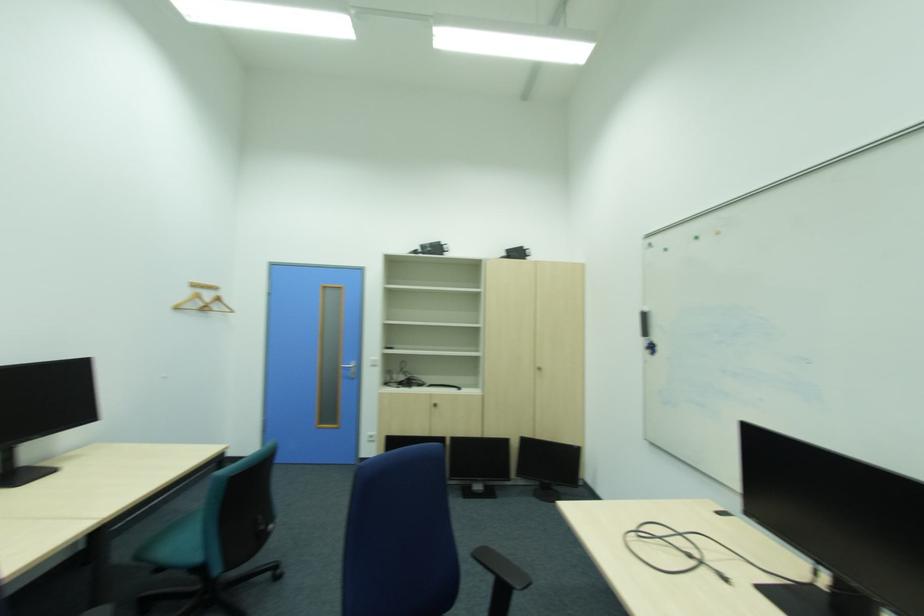
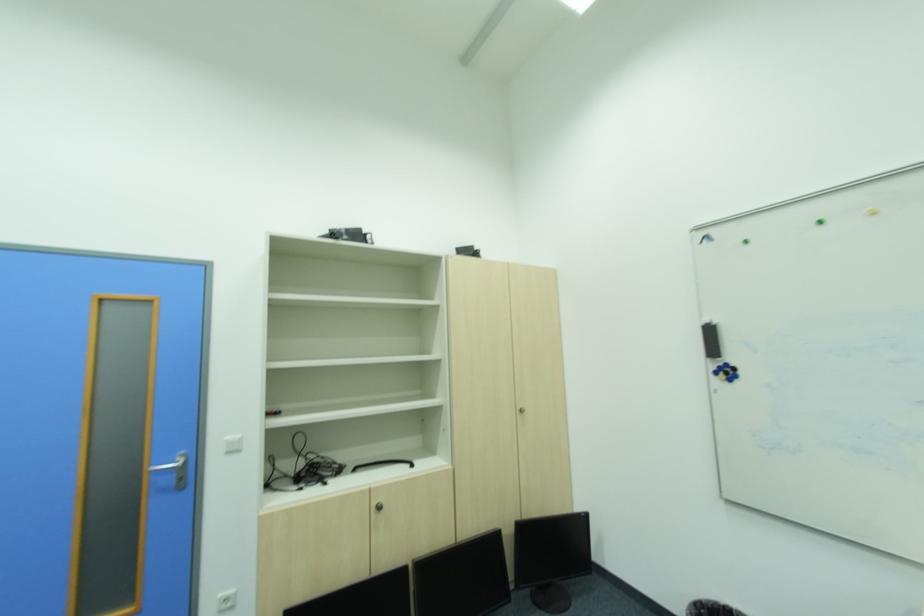
Locate, in the second image, the point that corresponds to (378,437) in the first image.

(234, 602)